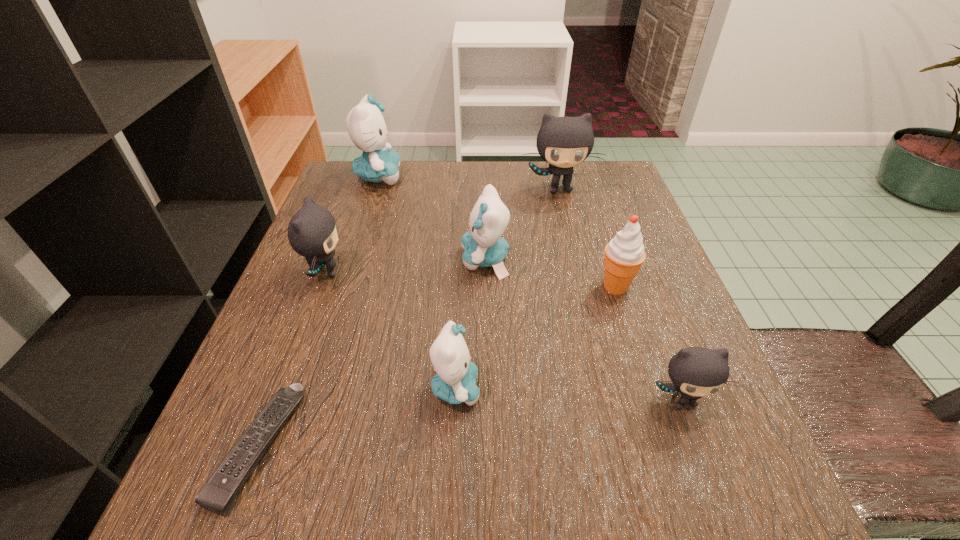
Image resolution: width=960 pixels, height=540 pixels. Identify the location of the biggest blue kitten. (365, 124).

You are a GUI agent. You are given a task and a screenshot of the screen. Output one action in this format:
    pyautogui.click(x=<x>, y=<y>)
    Task: Click on the farthest blue kitten
    The height and width of the screenshot is (540, 960).
    Given the screenshot: What is the action you would take?
    pyautogui.click(x=365, y=124)

You are a GUI agent. You are given a task and a screenshot of the screen. Output one action in this format:
    pyautogui.click(x=<x>, y=<y>)
    Task: Click on the farthest gray kitten
    The height and width of the screenshot is (540, 960).
    Given the screenshot: What is the action you would take?
    pyautogui.click(x=564, y=142)

I want to click on red icecream, so click(x=624, y=254).

Identify the location of the second farthest blue kitten. (483, 246).

Find the location of a particular element. the leftmost gray kitten is located at coordinates (312, 232).

You are a GUI agent. You are given a task and a screenshot of the screen. Output one action in this format:
    pyautogui.click(x=<x>, y=<y>)
    Task: Click on the second biggest gray kitten
    
    Given the screenshot: What is the action you would take?
    [x=312, y=232]

What are the coordinates of `the nearest blue kitten` in the screenshot? It's located at point(455,381).

What are the coordinates of `the smallest gray kitten` in the screenshot? It's located at (695, 372).

Identify the location of the shortest object. The height and width of the screenshot is (540, 960). (219, 493).